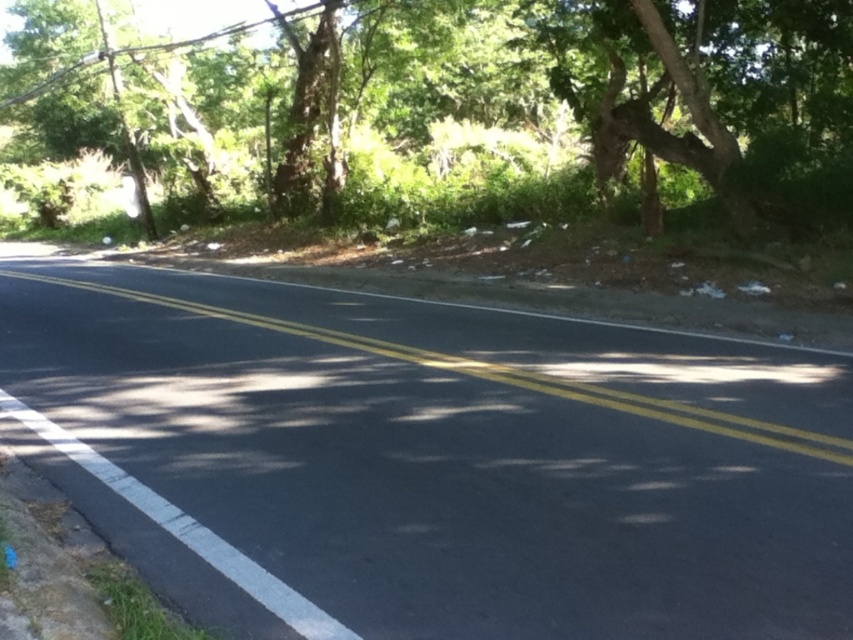
Does black asphalt road at center appear on the left side of green leafy tree at upper center?

No, black asphalt road at center is not to the left of green leafy tree at upper center.

Between point (387, 440) and point (506, 45), which one is positioned behind?

Positioned behind is point (506, 45).

Is point (103, 384) positioned behind point (393, 13)?

No, it is not.

The width and height of the screenshot is (853, 640). What are the coordinates of `black asphalt road at center` in the screenshot? It's located at coord(450,458).